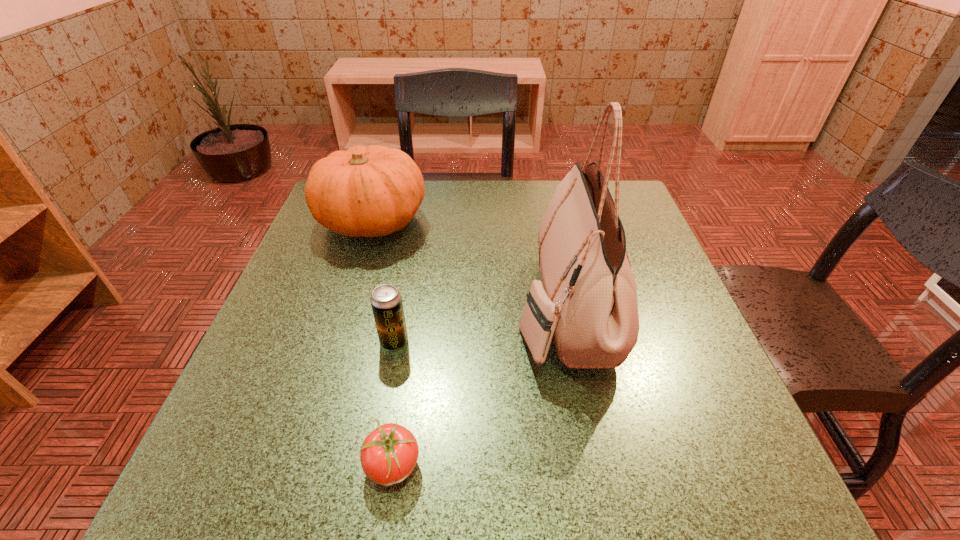
Locate an element on the screen. This screenshot has width=960, height=540. free spot between the second tallest object and the second shortest object is located at coordinates (383, 281).

Locate an element on the screen. blank region between the beer can and the rightmost object is located at coordinates (479, 325).

At what (x,y) coordinates should I click in order to perform the action: click on free space between the pumpkin and the beer can. Please return your answer as a coordinate pair (x, y). Image resolution: width=960 pixels, height=540 pixels. Looking at the image, I should click on (383, 281).

You are a GUI agent. You are given a task and a screenshot of the screen. Output one action in this format:
    pyautogui.click(x=<x>, y=<y>)
    Task: Click on the object that is the second closest one to the tomato
    This screenshot has height=540, width=960.
    Given the screenshot: What is the action you would take?
    pyautogui.click(x=586, y=300)

Identify the location of object identified as the closest to the beer can. (388, 455).

Identify the location of free region that satisfies the following two spatial constraints: 1. on the front side of the tomato; 2. on the right side of the third shortest object. The image size is (960, 540). (296, 465).

You are a GUI agent. You are given a task and a screenshot of the screen. Output one action in this format:
    pyautogui.click(x=<x>, y=<y>)
    Task: Click on the vacant space that satisfies the following two spatial constraints: 1. on the side of the rightmost object with the attached pouch; 2. on the front side of the beer can
    The width and height of the screenshot is (960, 540).
    Given the screenshot: What is the action you would take?
    pyautogui.click(x=571, y=342)

Find the location of a particular element. This screenshot has height=540, width=960. free spot that satisfies the following two spatial constraints: 1. on the front side of the beer can; 2. on the left side of the shortest object is located at coordinates (372, 465).